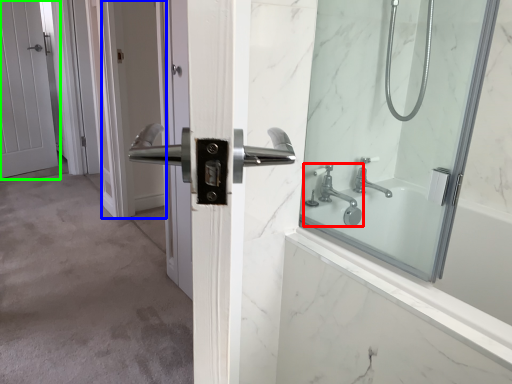
Question: Which object is the closest to the tap (highlighted by a red box)? Choose among these: screen door (highlighted by a blue box) or door (highlighted by a green box).

Choices:
 (A) screen door
 (B) door

Answer: (A)